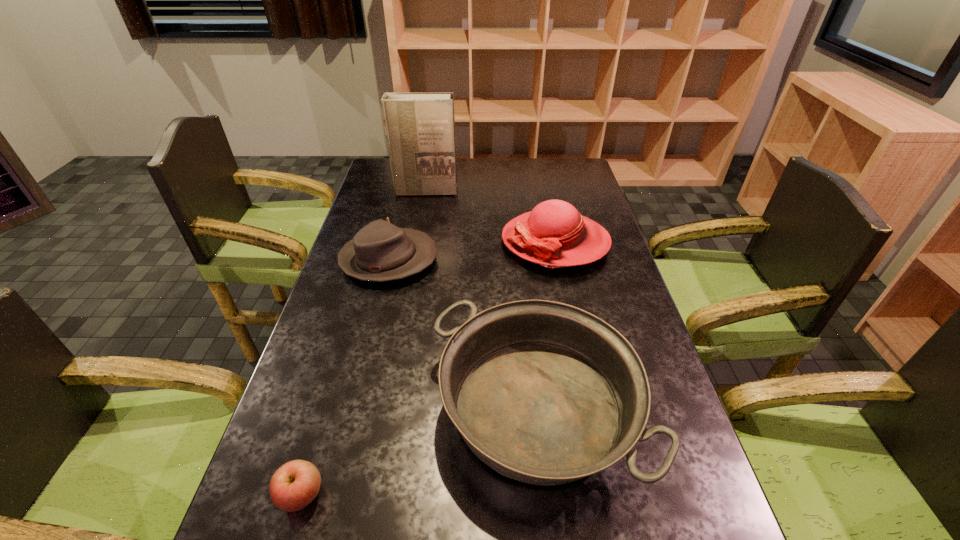
Locate an element on the screen. vacant space located at the front of the right hat with a bow is located at coordinates (415, 242).

The image size is (960, 540). I want to click on free space located on the back of the pan, so click(526, 313).

Identify the location of free space located on the decorative side of the left hat. (545, 260).

You are a GUI agent. You are given a task and a screenshot of the screen. Output one action in this format:
    pyautogui.click(x=<x>, y=<y>)
    Task: Click on the free location located on the right of the apple
    The image size is (960, 540).
    Given the screenshot: What is the action you would take?
    pyautogui.click(x=436, y=495)

Where is `object located at the far edge`? object located at the far edge is located at coordinates (420, 127).

The height and width of the screenshot is (540, 960). Find the location of `phonebook that is positioned at the left edge`. phonebook that is positioned at the left edge is located at coordinates (420, 127).

At what (x,y) coordinates should I click in order to perform the action: click on hat that is at the left edge. Please return your answer as a coordinate pair (x, y). The width and height of the screenshot is (960, 540). Looking at the image, I should click on pyautogui.click(x=380, y=251).

The height and width of the screenshot is (540, 960). In order to click on apple at the left edge in this screenshot , I will do `click(294, 485)`.

The image size is (960, 540). Identify the location of hat that is at the right edge. (554, 234).

Where is `pan that is at the right edge`? pan that is at the right edge is located at coordinates (545, 393).